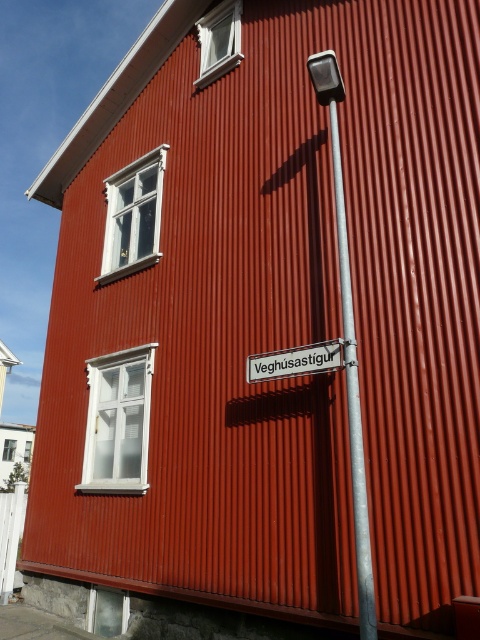
Question: Can you confirm if metallic silver pole at center is smaller than metallic silver street sign at center?

Choices:
 (A) no
 (B) yes

Answer: (B)

Question: From the image, what is the correct spatial relationship of metallic silver pole at center in relation to metallic silver street sign at center?

Choices:
 (A) above
 (B) below

Answer: (B)

Question: Among these points, which one is farthest from the camera?

Choices:
 (A) (348, 364)
 (B) (339, 365)

Answer: (B)

Question: Is metallic silver pole at center bigger than metallic silver street sign at center?

Choices:
 (A) no
 (B) yes

Answer: (A)

Question: Which object is closer to the camera taking this photo?

Choices:
 (A) metallic silver pole at center
 (B) metallic silver street sign at center

Answer: (A)